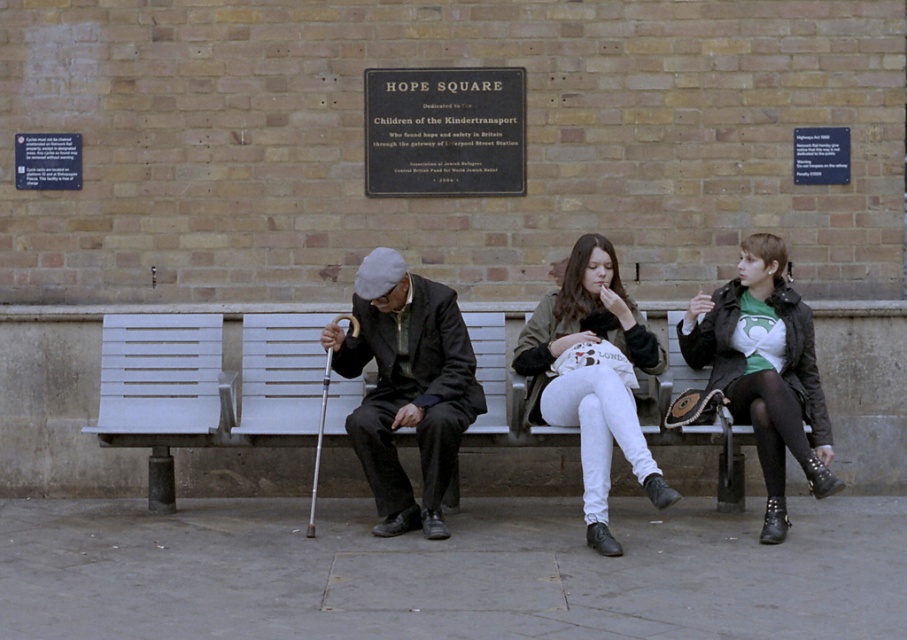
Between dark gray woolen hat at center and white cotton pants at center, which one appears on the right side from the viewer's perspective?

white cotton pants at center is more to the right.

Which is in front, point (408, 317) or point (600, 308)?

Point (408, 317)

Locate an element on the screen. dark gray woolen hat at center is located at coordinates (406, 387).

Describe the element at coordinates (406, 387) in the screenshot. I see `dark gray woolen hat at center` at that location.

This screenshot has width=907, height=640. I want to click on dark gray woolen hat at center, so click(406, 387).

Is point (488, 340) behind point (740, 333)?

That is True.

Locate an element on the screen. white wooden bench at center is located at coordinates (205, 387).

Between point (114, 422) and point (783, 481), which one is positioned behind?

Point (114, 422)

I want to click on white wooden bench at center, so click(x=205, y=387).